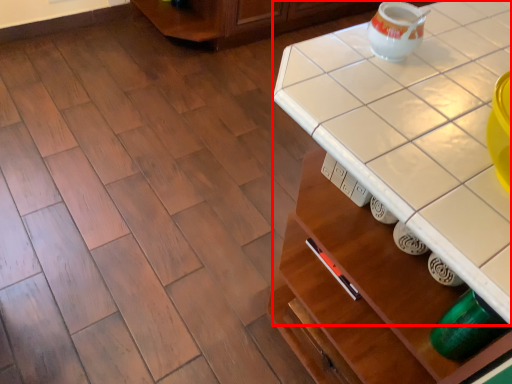
Question: Where is counter top (annotated by the red box) located in relation to tea pot in the image?

Choices:
 (A) left
 (B) right

Answer: (B)